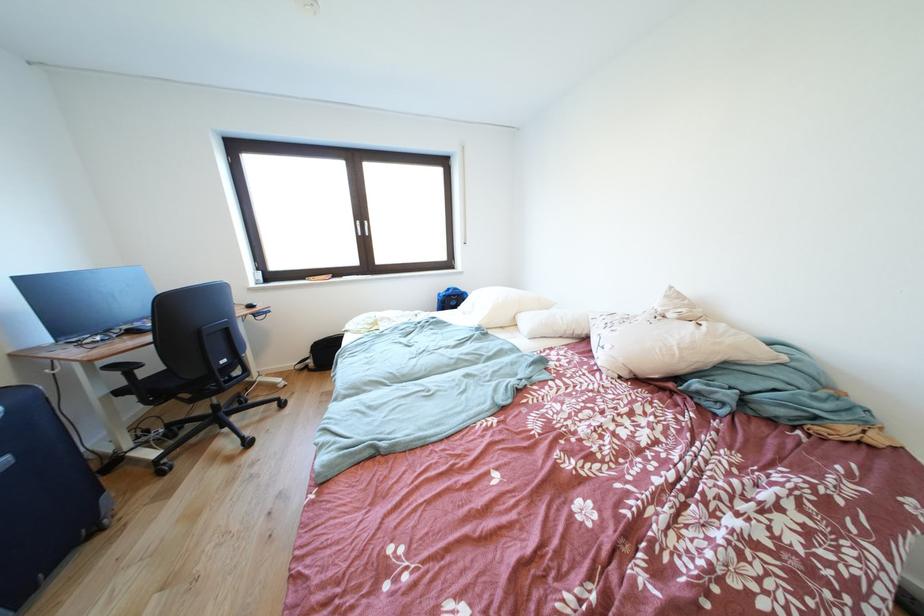
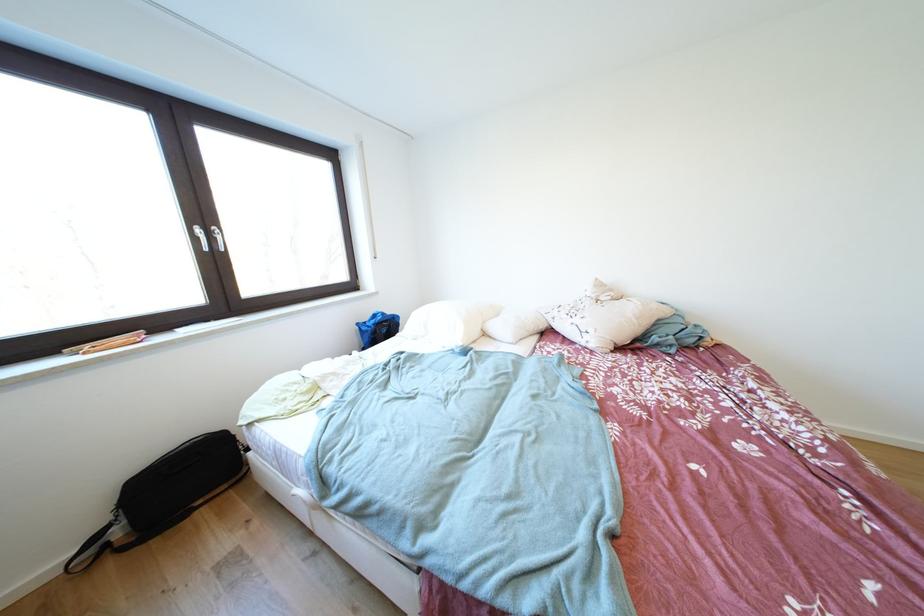
Find the pixel in the second image that matches (x=679, y=292) in the first image.

(604, 284)